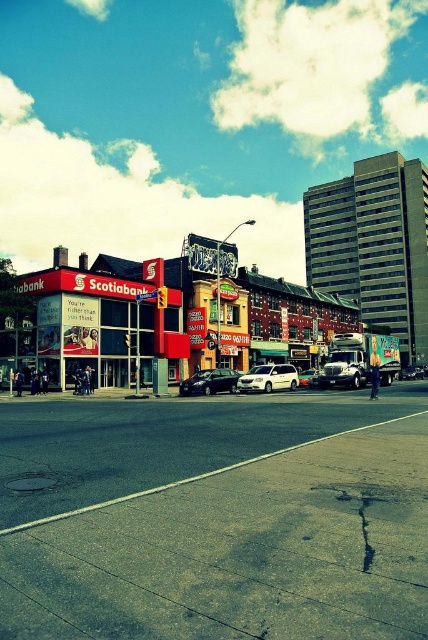
You are a pedestrian standing on the sidewalk near the red Scotiabank branch. You need to cross the road to reach the Pizza Pizza restaurant on the left. Which vehicle, the shiny black sedan at center or the metallic silver truck at center, should you wait behind to safely cross the road?

You should wait behind the metallic silver truck at center because the shiny black sedan at center is positioned on the left side of it, meaning the truck is closer to the sidewalk where you are standing. This placement would make the truck the nearest vehicle to you, providing a safer spot to wait before crossing.

You are a delivery driver who needs to park your silver metallic sedan at center in a parking spot next to the matte red bank at center. However, the parking spot is only large enough for vehicles smaller than the bank. Can your sedan fit in the spot?

The matte red bank at center is bigger than the silver metallic sedan at center, so the sedan should fit in the parking spot since it is smaller than the bank.

You are a delivery person trying to park your motorcycle between the shiny black sedan at center and the metallic silver truck at center. Considering their sizes, which vehicle should you position your motorcycle closer to for better space management?

The shiny black sedan at center is larger than the metallic silver truck at center, so positioning the motorcycle closer to the metallic silver truck at center would provide more space for maneuvering.